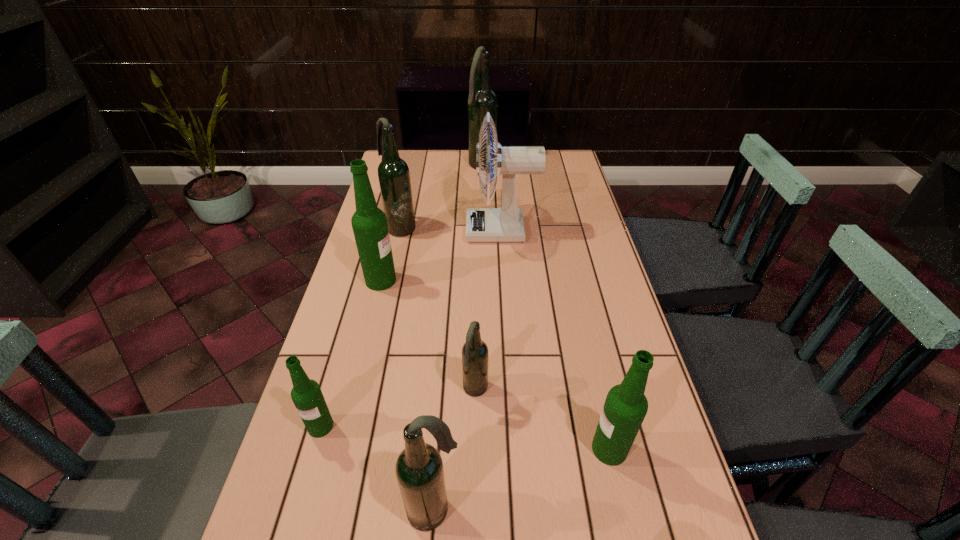
This screenshot has height=540, width=960. What are the coordinates of `free spot at the right edge of the desktop` in the screenshot? It's located at (578, 207).

Identify the location of vacant space at the far right corner. This screenshot has width=960, height=540. (554, 174).

Identify the location of blank region between the nearest object and the second nearest dark beer bottle. Image resolution: width=960 pixels, height=540 pixels. 454,450.

You are a GUI agent. You are given a task and a screenshot of the screen. Output one action in this format:
    pyautogui.click(x=<x>, y=<y>)
    Task: Click on the vacant space in between the blue fan and the rightmost object
    This screenshot has height=540, width=960.
    Given the screenshot: What is the action you would take?
    pyautogui.click(x=556, y=340)

Where is `free point between the fan and the rightmost beer bottle`? Image resolution: width=960 pixels, height=540 pixels. free point between the fan and the rightmost beer bottle is located at coordinates (556, 340).

Identify the location of vacant space that is in between the second farthest beer bottle and the second smallest green beer bottle. (505, 338).

You are a GUI agent. You are given a task and a screenshot of the screen. Output one action in this format:
    pyautogui.click(x=<x>, y=<y>)
    Task: Click on the vacant space that is in between the second nearest dark beer bottle and the third biggest dark beer bottle
    The image size is (960, 540).
    Given the screenshot: What is the action you would take?
    (454, 450)

At what (x,y) coordinates should I click in order to perform the action: click on free spot between the fan and the fourth nearest object. Please return your answer as a coordinate pair (x, y). The image size is (960, 540). Looking at the image, I should click on (489, 310).

Find the location of `vacant space that's between the fifth farthest object and the biggest green beer bottle`. vacant space that's between the fifth farthest object and the biggest green beer bottle is located at coordinates (428, 335).

Choose which object is the second nearest neighbor to the rightmost beer bottle. Please provide its 2D coordinates. Your answer should be formatted as a tuple, i.e. [(x, y)], where the tuple contains the x and y coordinates of a point satisfying the conditions above.

[(419, 469)]